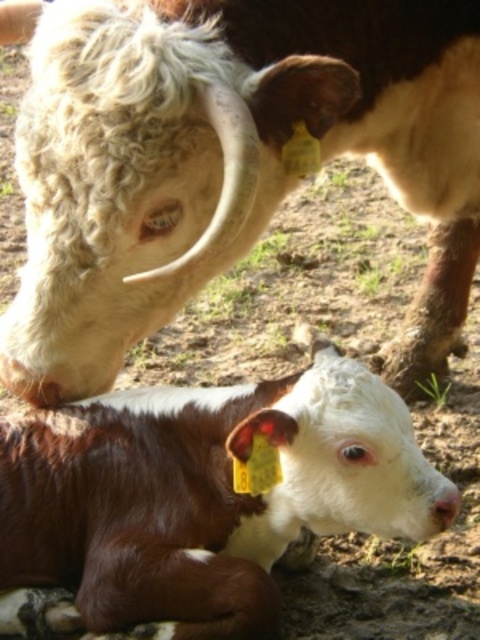
From the picture: You are a farmer checking the ear tags of the animals in the field. You notice the white woolen head at upper left and the brown glossy calf at lower left. Which animal has a wider head?

The white woolen head at upper left might be wider than brown glossy calf at lower left.

You are a farmer using a drone to monitor your herd. The drone has a camera with a field of view that covers the entire image. If you want to zoom in on the white woolen head at upper left, which coordinate should you center the camera on?

The white woolen head at upper left is located at coordinate point (227,163), so you should center the camera on that coordinate to zoom in.

You are a farmer standing in the field and want to check the white woolen head at upper left. Can you reach it with a 1.2 meter long stick?

The distance of white woolen head at upper left from camera is 1.17 meters, so yes, the 1.2 meter long stick can reach it.